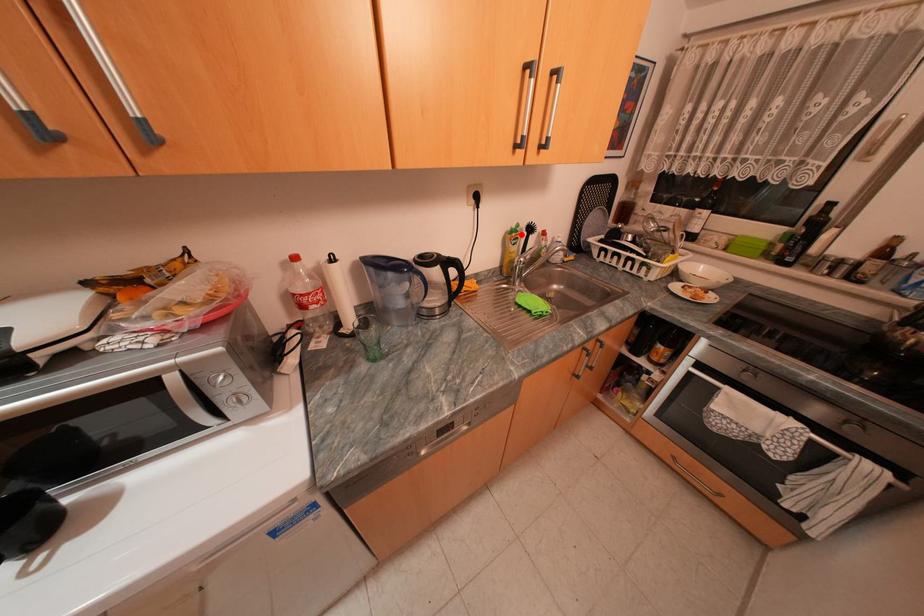
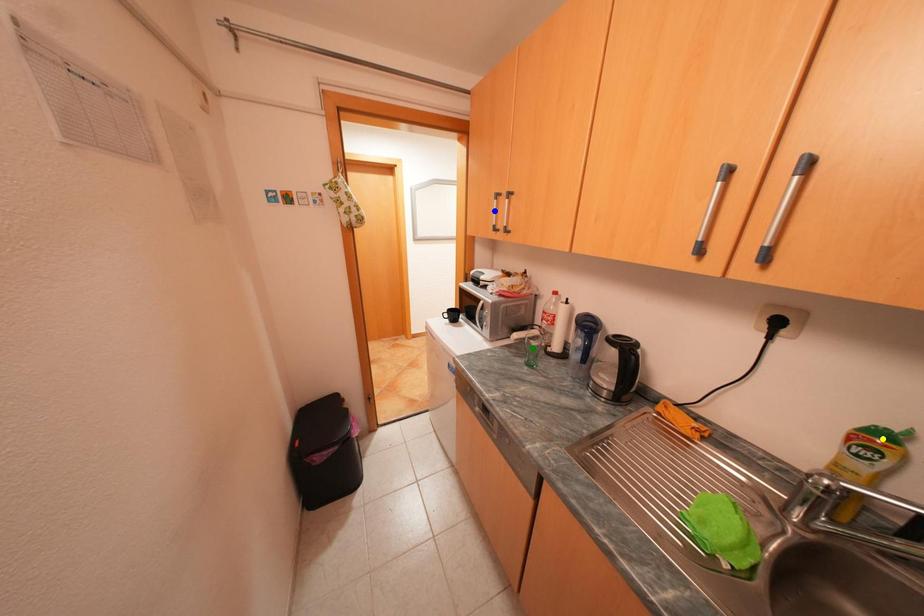
Question: I am providing you with two images of the same scene from different viewpoints. A red point is marked on the first image. You are given multiple points on the second image. In image 2, which mark is for the same physical point as the one in image 1?

Choices:
 (A) green point
 (B) blue point
 (C) yellow point

Answer: (C)